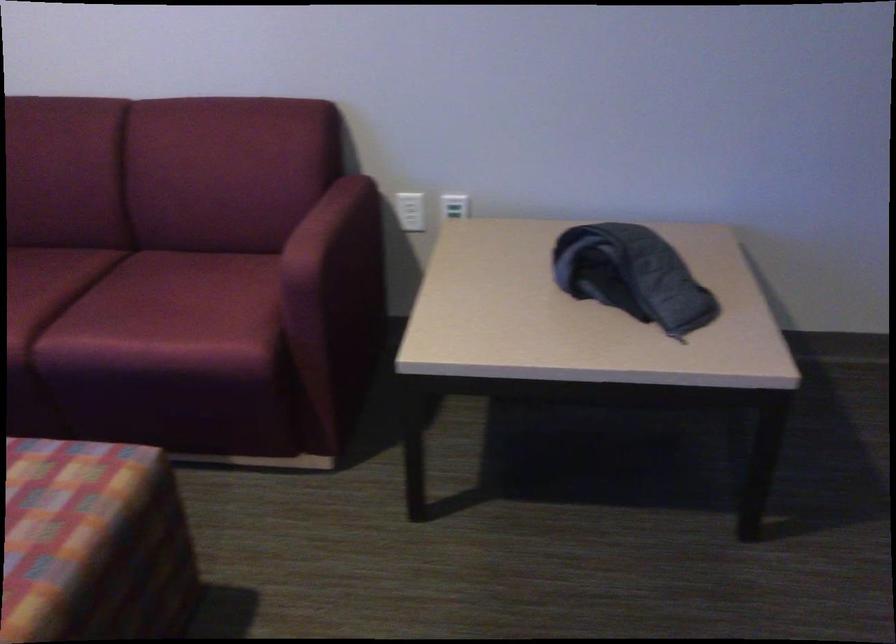
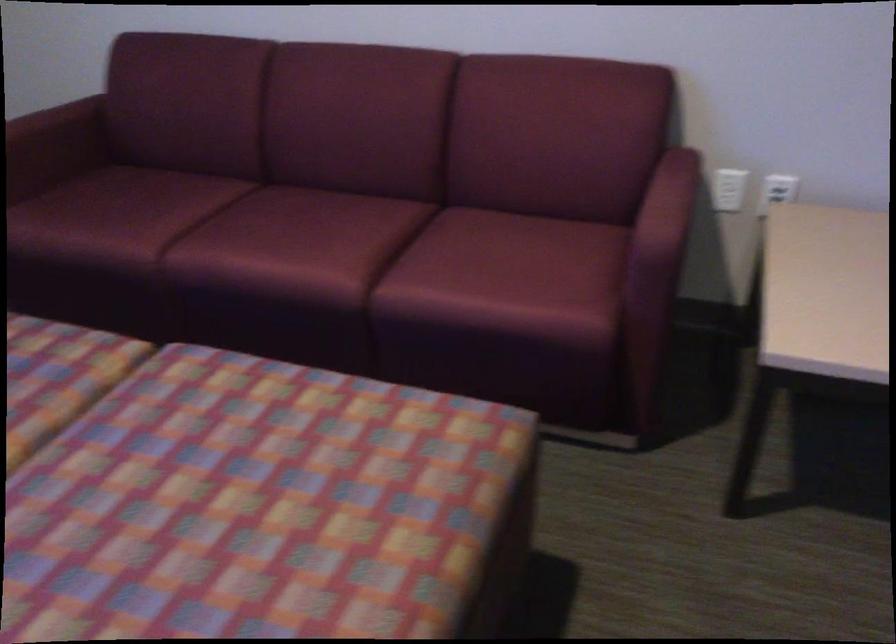
Question: I am providing you with two images of the same scene from different viewpoints. Please identify which objects are invisible in image2.

Choices:
 (A) white electrical outlet
 (B) red sofa sitting surface
 (C) black iron handle
 (D) sofa armrest

Answer: (D)